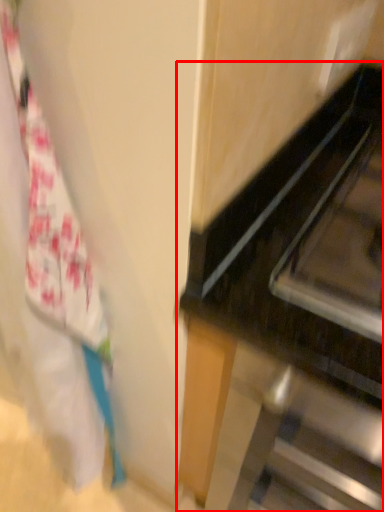
Question: Observing the image, what is the correct spatial positioning of furniture (annotated by the red box) in reference to laundry?

Choices:
 (A) left
 (B) right

Answer: (B)